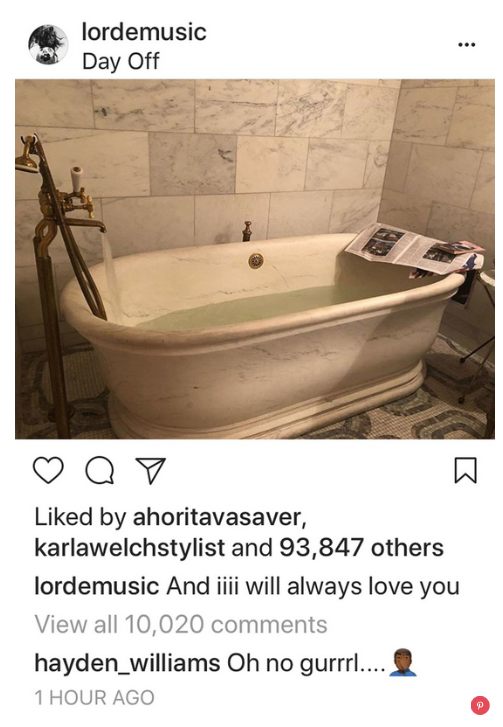
Find the location of `bottom of tub`. bottom of tub is located at coordinates (337, 406).